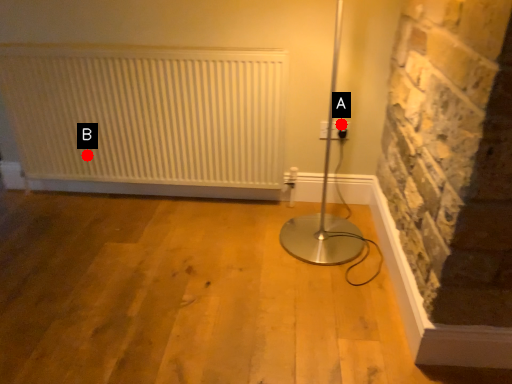
Question: Two points are circled on the image, labeled by A and B beside each circle. Which point is farther to the camera?

Choices:
 (A) A is further
 (B) B is further

Answer: (B)